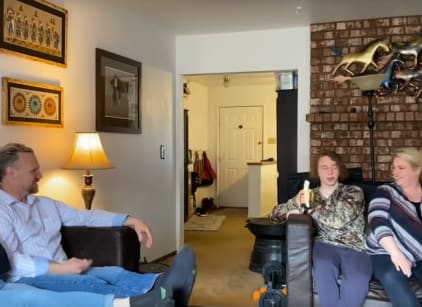
Locate an element on the screen. light switchlamp is located at coordinates (163, 151), (94, 149).